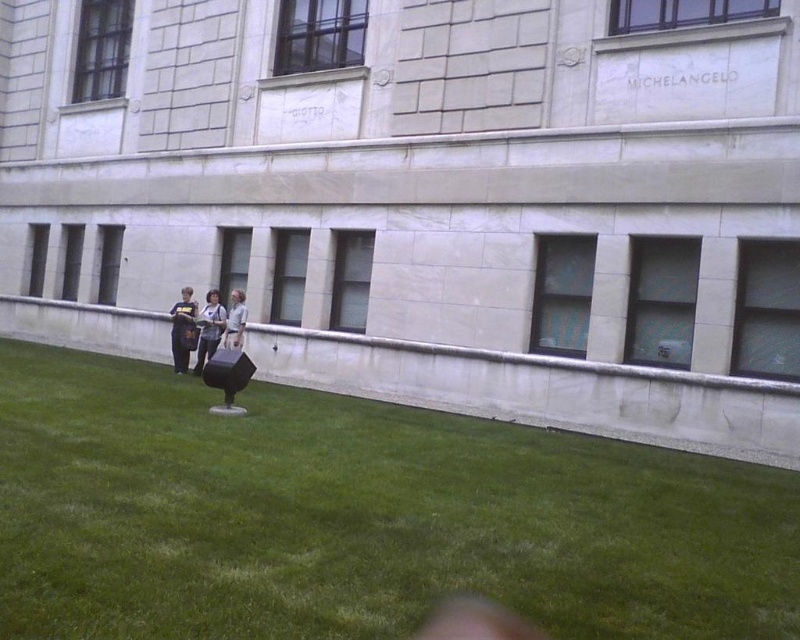
Measure the distance between green grass at lower center and dark blue shirt at center.

The distance of green grass at lower center from dark blue shirt at center is 6.21 meters.

Is green grass at lower center further to camera compared to dark blue shirt at center?

No, it is in front of dark blue shirt at center.

Does point (644, 579) lie behind point (180, 328)?

That is False.

Find the location of `green grass at lower center`. green grass at lower center is located at coordinates (360, 516).

Who is more forward, (204, 486) or (230, 301)?

Point (204, 486)

From the picture: Does green grass at lower center have a lesser height compared to light gray shirt at center?

Correct, green grass at lower center is not as tall as light gray shirt at center.

Which is behind, point (69, 356) or point (238, 326)?

The point (69, 356) is more distant.

Identify the location of green grass at lower center. (360, 516).

Who is more forward, (x=186, y=316) or (x=226, y=330)?

Point (x=226, y=330) is more forward.

The height and width of the screenshot is (640, 800). I want to click on dark blue shirt at center, so click(x=184, y=330).